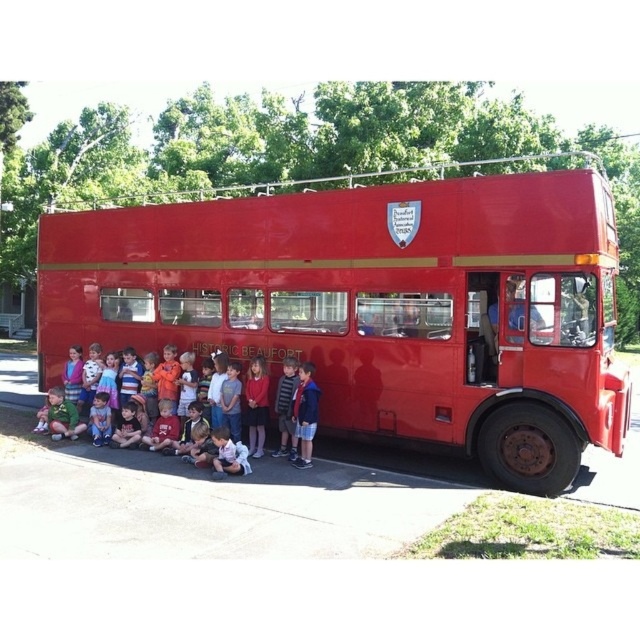
You are a photographer trying to capture a clear shot of the shiny red bus at center without the matte red shirt at lower center blocking the view. Based on their positions, is this possible?

Yes, since the shiny red bus at center is in front of the matte red shirt at lower center, the bus itself is closer to the camera, so you can take a clear shot of the shiny red bus at center without the matte red shirt at lower center blocking the view.

You are standing at the center of the image. Where is the shiny red bus at center located relative to your position?

The shiny red bus at center is located at point coordinates of (x=376, y=305) relative to the center of the image.

You are a photographer trying to capture a photo of the shiny red bus at center and the matte red shirt at lower center. Since both are red, you want to ensure they are distinguishable in the photo. Which object should you focus on first to make sure they are both in clear view?

You should focus on the shiny red bus at center first because it is to the left of the matte red shirt at lower center, so adjusting focus from left to right will ensure both are clear.